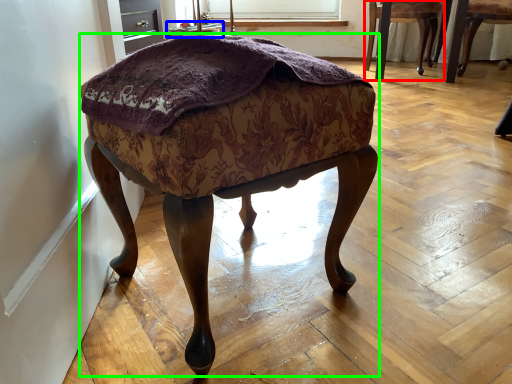
Question: Which object is the closest to the chair (highlighted by a red box)? Choose among these: side table (highlighted by a blue box) or stool (highlighted by a green box).

Choices:
 (A) side table
 (B) stool

Answer: (A)